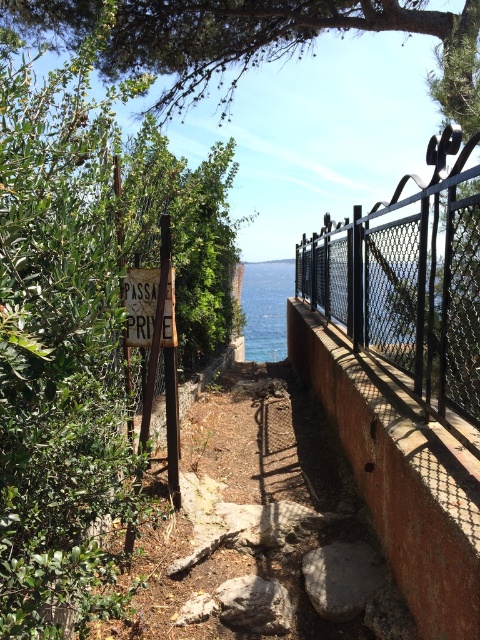
Question: Among these points, which one is farthest from the camera?

Choices:
 (A) (299, 394)
 (B) (108, 336)

Answer: (A)

Question: Can you confirm if blue water at center is thinner than wooden signboard at center?

Choices:
 (A) yes
 (B) no

Answer: (B)

Question: Which is farther from the green leafy tree at left?

Choices:
 (A) black metal fence at upper right
 (B) blue water at center

Answer: (B)

Question: Considering the real-world distances, which object is closest to the blue water at center?

Choices:
 (A) green leafy tree at left
 (B) wooden signboard at center
 (C) brown stone wall at center
 (D) black metal fence at upper right

Answer: (C)

Question: Can you confirm if blue water at center is positioned to the right of wooden signboard at center?

Choices:
 (A) no
 (B) yes

Answer: (B)

Question: Is black metal fence at upper right thinner than blue water at upper center?

Choices:
 (A) no
 (B) yes

Answer: (B)